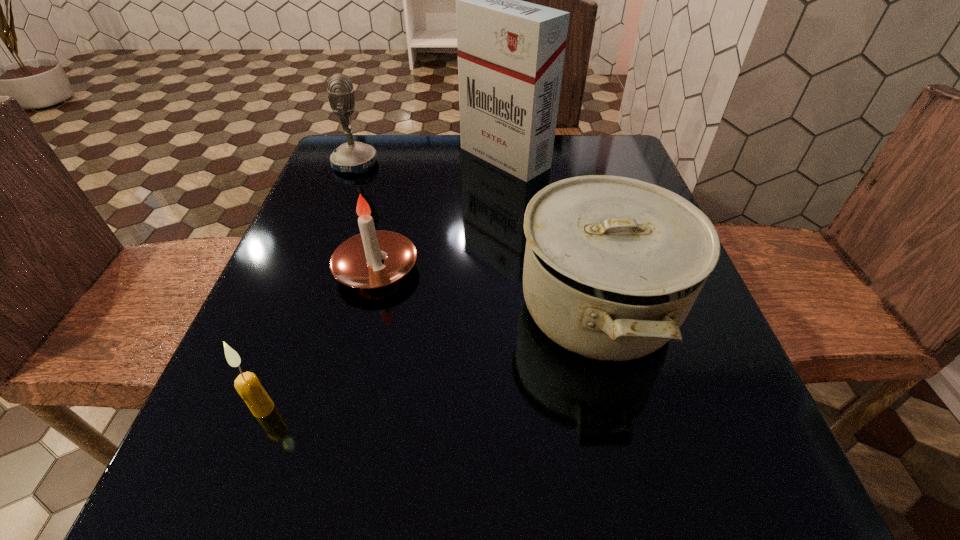
Where is `the tallest object`? the tallest object is located at coordinates (511, 53).

Locate an element on the screen. This screenshot has width=960, height=540. microphone is located at coordinates (354, 157).

You are a GUI agent. You are given a task and a screenshot of the screen. Output one action in this format:
    pyautogui.click(x=<x>, y=<y>)
    Task: Click on the saucepan
    The image size is (960, 540).
    Given the screenshot: What is the action you would take?
    pyautogui.click(x=613, y=265)

This screenshot has width=960, height=540. Identify the location of the farther candle. (356, 262).

I want to click on the nearer candle, so click(248, 386).

Find the location of a particular element. free space located on the left of the cigarette case is located at coordinates (351, 158).

At what (x,y) coordinates should I click in order to perform the action: click on vacant area located on the front-facing side of the microphone. Please return your answer as a coordinate pair (x, y). Image resolution: width=960 pixels, height=540 pixels. Looking at the image, I should click on (506, 164).

This screenshot has height=540, width=960. Identify the location of free space located on the front of the saucepan. (648, 516).

Where is `free location located on the back of the right candle`? free location located on the back of the right candle is located at coordinates (407, 142).

You are a GUI agent. You are given a task and a screenshot of the screen. Output one action in this format:
    pyautogui.click(x=<x>, y=<y>)
    Task: Click on the free space located 0.210m on the back of the nearer candle
    The image size is (960, 540).
    Given the screenshot: What is the action you would take?
    pyautogui.click(x=307, y=291)